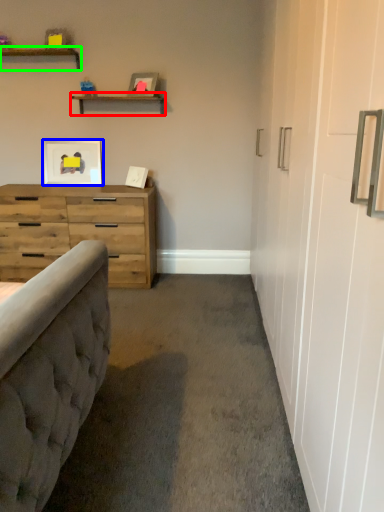
Question: Based on their relative distances, which object is farther from shelf (highlighted by a red box)? Choose from picture frame (highlighted by a blue box) and shelf (highlighted by a green box).

Choices:
 (A) picture frame
 (B) shelf

Answer: (A)